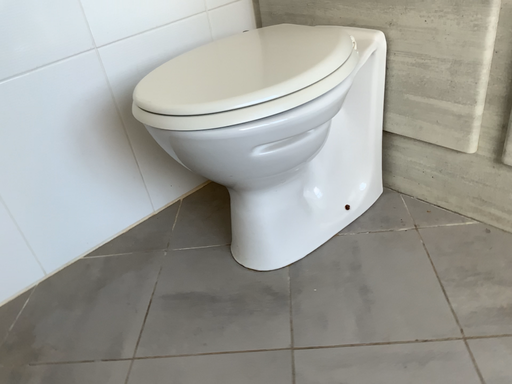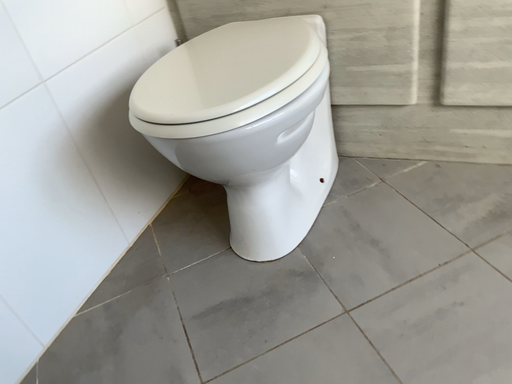
Question: Which way did the camera rotate in the video?

Choices:
 (A) rotated right
 (B) rotated left

Answer: (A)